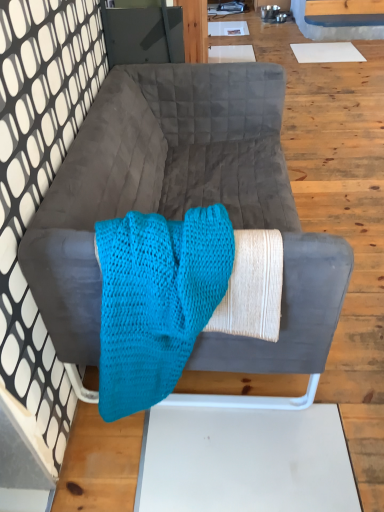
Describe the element at coordinates (184, 206) in the screenshot. I see `velvet gray couch at center` at that location.

Locate an element on the screen. velvet gray couch at center is located at coordinates (184, 206).

What do you see at coordinates (156, 300) in the screenshot? I see `turquoise knitted blanket at center` at bounding box center [156, 300].

Measure the distance between turquoise knitted blanket at center and camera.

turquoise knitted blanket at center is 34.53 inches away from camera.

You are a GUI agent. You are given a task and a screenshot of the screen. Output one action in this format:
    pyautogui.click(x=<x>, y=<y>)
    Task: Click on the turquoise knitted blanket at center
    
    Given the screenshot: What is the action you would take?
    pyautogui.click(x=156, y=300)

Where is `velvet gray couch at center`? velvet gray couch at center is located at coordinates (184, 206).

Which object is positioned more to the left, velvet gray couch at center or turquoise knitted blanket at center?

Positioned to the left is turquoise knitted blanket at center.

Which is in front, velvet gray couch at center or turquoise knitted blanket at center?

turquoise knitted blanket at center is more forward.

Which is nearer, [242,136] or [167,300]?

Point [242,136].

From the image's perspective, who appears lower, velvet gray couch at center or turquoise knitted blanket at center?

From the image's view, turquoise knitted blanket at center is below.

From a real-world perspective, which object rests below the other?

velvet gray couch at center.

Does velvet gray couch at center have a lesser width compared to turquoise knitted blanket at center?

In fact, velvet gray couch at center might be wider than turquoise knitted blanket at center.

Is velvet gray couch at center shorter than turquoise knitted blanket at center?

No.

Based on their sizes in the image, would you say velvet gray couch at center is bigger or smaller than turquoise knitted blanket at center?

In the image, velvet gray couch at center appears to be larger than turquoise knitted blanket at center.

Is turquoise knitted blanket at center completely or partially inside velvet gray couch at center?

Yes, velvet gray couch at center is surrounding turquoise knitted blanket at center.

Is velvet gray couch at center far from turquoise knitted blanket at center?

Actually, velvet gray couch at center and turquoise knitted blanket at center are a little close together.

Is velvet gray couch at center positioned with its back to turquoise knitted blanket at center?

No, turquoise knitted blanket at center is not at the back of velvet gray couch at center.

How many degrees apart are the facing directions of velvet gray couch at center and turquoise knitted blanket at center?

velvet gray couch at center and turquoise knitted blanket at center are facing 90.5 degrees away from each other.

Locate an element on the screen. The image size is (384, 512). blanket on the left of the velvet gray couch at center is located at coordinates (156, 300).

Which is more to the right, turquoise knitted blanket at center or velvet gray couch at center?

From the viewer's perspective, velvet gray couch at center appears more on the right side.

From the picture: Is turquoise knitted blanket at center in front of velvet gray couch at center?

Yes, it is in front of velvet gray couch at center.

Is point (209, 280) positioned after point (76, 163)?

No.

From the image's perspective, which is above, turquoise knitted blanket at center or velvet gray couch at center?

From the image's view, velvet gray couch at center is above.

From a real-world perspective, relative to velvet gray couch at center, is turquoise knitted blanket at center vertically above or below?

From a real-world perspective, turquoise knitted blanket at center is physically above velvet gray couch at center.

In terms of width, does turquoise knitted blanket at center look wider or thinner when compared to velvet gray couch at center?

turquoise knitted blanket at center is thinner than velvet gray couch at center.

Can you confirm if turquoise knitted blanket at center is taller than velvet gray couch at center?

No, turquoise knitted blanket at center is not taller than velvet gray couch at center.

Based on their sizes in the image, would you say turquoise knitted blanket at center is bigger or smaller than velvet gray couch at center?

In the image, turquoise knitted blanket at center appears to be smaller than velvet gray couch at center.

Is velvet gray couch at center surrounded by turquoise knitted blanket at center?

Actually, velvet gray couch at center is outside turquoise knitted blanket at center.

Is turquoise knitted blanket at center beside velvet gray couch at center?

turquoise knitted blanket at center and velvet gray couch at center are clearly separated.

Is turquoise knitted blanket at center looking in the opposite direction of velvet gray couch at center?

Correct, turquoise knitted blanket at center is looking away from velvet gray couch at center.

Find the location of `blanket below the velvet gray couch at center (from the image's perspective)`. blanket below the velvet gray couch at center (from the image's perspective) is located at coordinates (156, 300).

Where is `blanket that is in front of the velvet gray couch at center`? This screenshot has width=384, height=512. blanket that is in front of the velvet gray couch at center is located at coordinates (156, 300).

I want to click on studio couch that is behind the turquoise knitted blanket at center, so click(x=184, y=206).